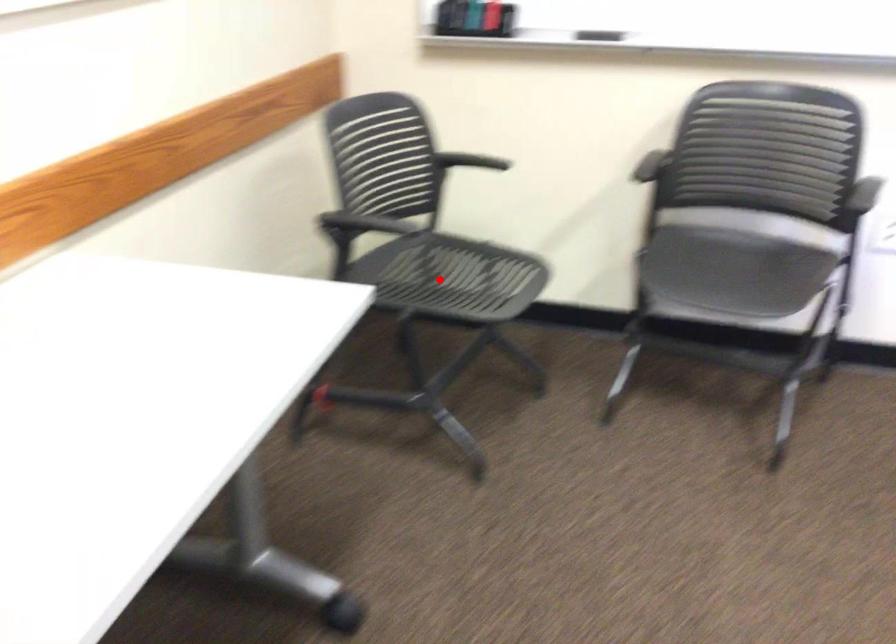
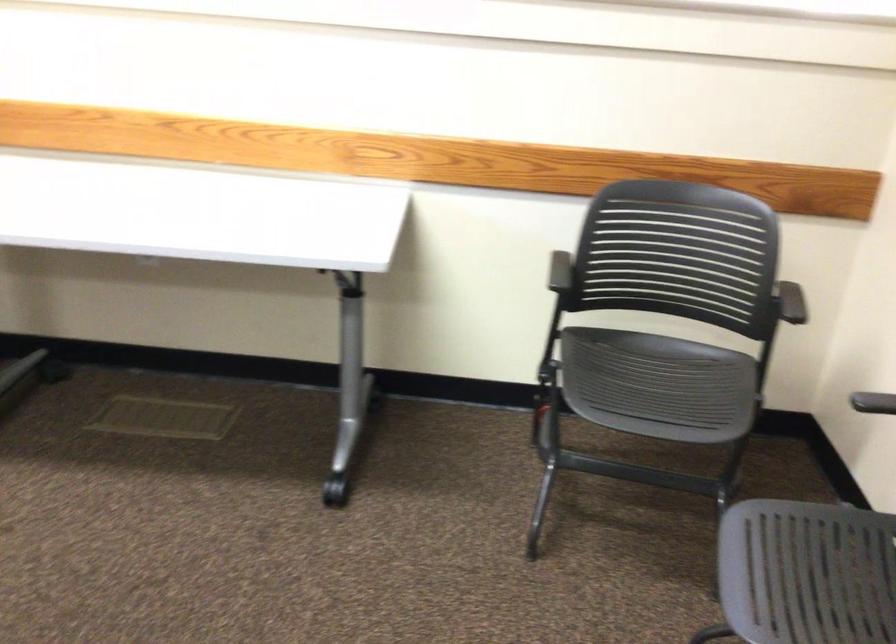
Question: I am providing you with two images of the same scene from different viewpoints. A red point is marked on the first image. At the location where the point appears in image 1, is it still visible in image 2?

Choices:
 (A) Yes
 (B) No

Answer: (A)